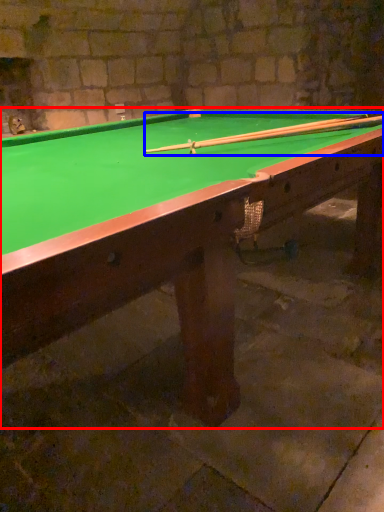
Question: Among these objects, which one is farthest to the camera, billiard table (highlighted by a red box) or cue (highlighted by a blue box)?

Choices:
 (A) billiard table
 (B) cue

Answer: (B)